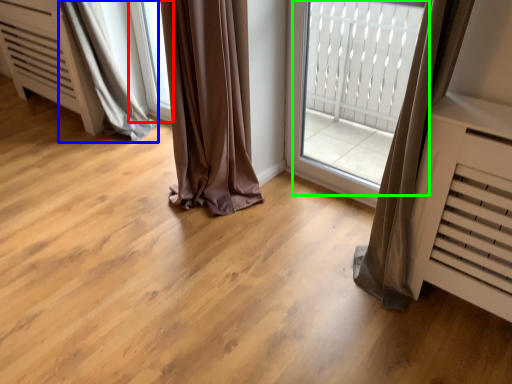
Question: Which is farther away from window (highlighted by a red box)? curtain (highlighted by a blue box) or bay window (highlighted by a green box)?

Choices:
 (A) curtain
 (B) bay window

Answer: (B)